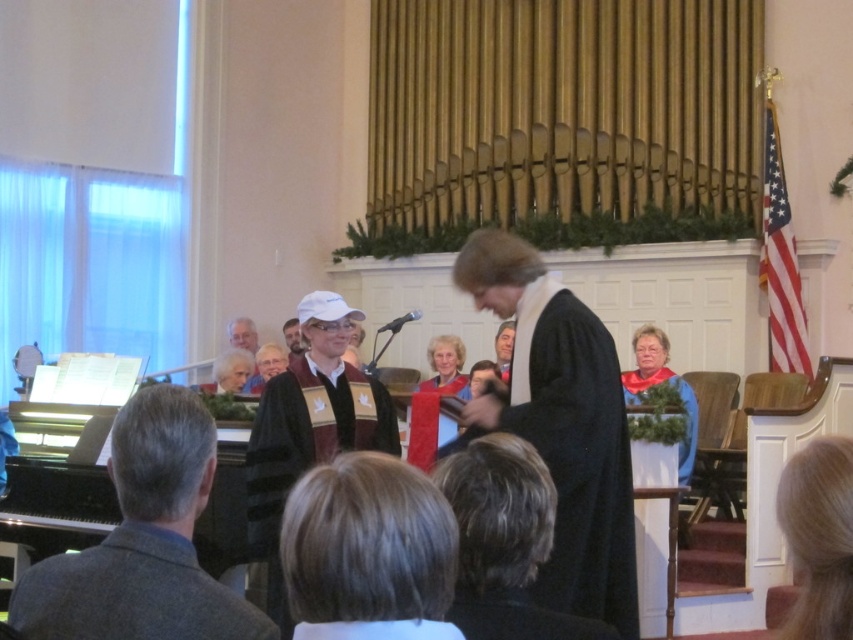
What are the coordinates of `blue fabric scarf at right` in the screenshot? It's located at (659, 381).

Does blue fabric scarf at right have a greater width compared to smooth brown robe at center?

Yes, blue fabric scarf at right is wider than smooth brown robe at center.

Is point (682, 387) positioned before point (296, 330)?

Yes, point (682, 387) is in front of point (296, 330).

Image resolution: width=853 pixels, height=640 pixels. In order to click on blue fabric scarf at right in this screenshot , I will do pyautogui.click(x=659, y=381).

Is blonde hair at center to the left of smooth brown robe at center from the viewer's perspective?

No, blonde hair at center is not to the left of smooth brown robe at center.

Measure the distance between blonde hair at center and smooth brown robe at center.

blonde hair at center and smooth brown robe at center are 24.87 feet apart from each other.

This screenshot has width=853, height=640. Find the location of `blonde hair at center`. blonde hair at center is located at coordinates (367, 547).

At what (x,y) coordinates should I click in order to perform the action: click on blonde hair at center. Please return your answer as a coordinate pair (x, y). Looking at the image, I should click on click(x=367, y=547).

Is maroon velvet stole at center wider than matte brown robe at center?

Correct, the width of maroon velvet stole at center exceeds that of matte brown robe at center.

The height and width of the screenshot is (640, 853). I want to click on maroon velvet stole at center, so click(x=305, y=449).

In order to click on maroon velvet stole at center in this screenshot , I will do `click(305, 449)`.